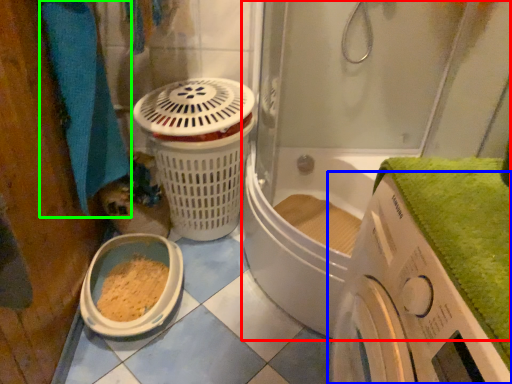
Question: Which object is positioned farthest from shower door (highlighted by a red box)? Select from washing machine (highlighted by a blue box) and bath towel (highlighted by a green box).

Choices:
 (A) washing machine
 (B) bath towel

Answer: (B)